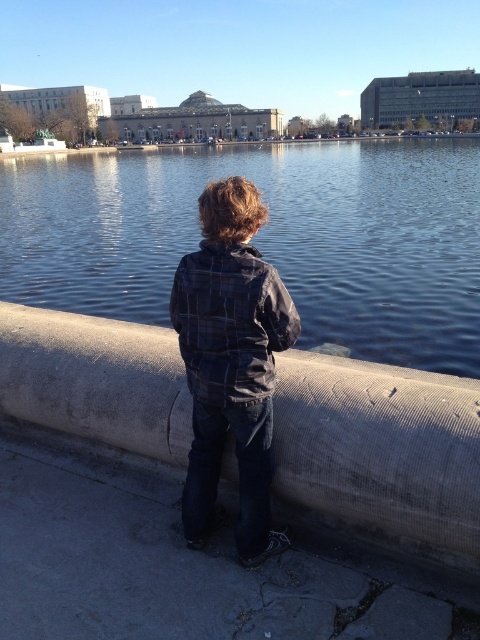
Based on the scene description, can you determine if the blue water at center is above or below the concrete at center?

The blue water at center is above the concrete at center.

You are a photographer wanting to capture the reflection of the blue water at center in your shot. Since the concrete at center might block the view, can you determine which area is larger to frame the shot better?

The blue water at center is bigger than concrete at center, so framing the shot to include the larger blue water at center will better capture the reflection.

You are a delivery robot with a 1.5 meter long package. You need to place the package between the concrete at center and the plaid fabric jacket at center. Is there enough space to fit the package without bending it?

The distance between the concrete at center and the plaid fabric jacket at center is 1.41 meters. Since the package is 1.5 meters long, it won t fit without bending it.